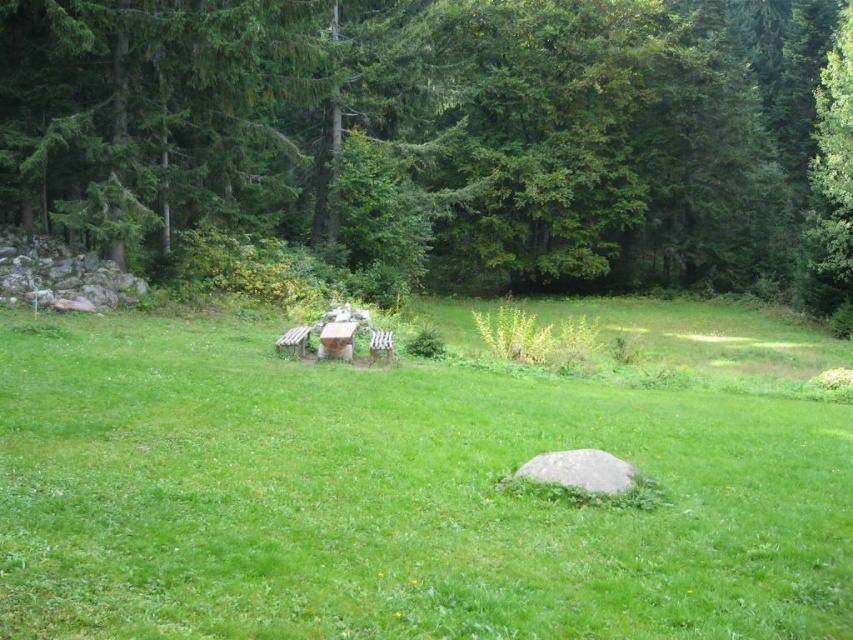
Does green grassy field at center have a lesser width compared to green leafy tree at upper center?

Indeed, green grassy field at center has a lesser width compared to green leafy tree at upper center.

What do you see at coordinates (395, 497) in the screenshot?
I see `green grassy field at center` at bounding box center [395, 497].

Is point (35, 404) behind point (525, 182)?

No, (35, 404) is in front of (525, 182).

The image size is (853, 640). In order to click on green grassy field at center in this screenshot , I will do `click(395, 497)`.